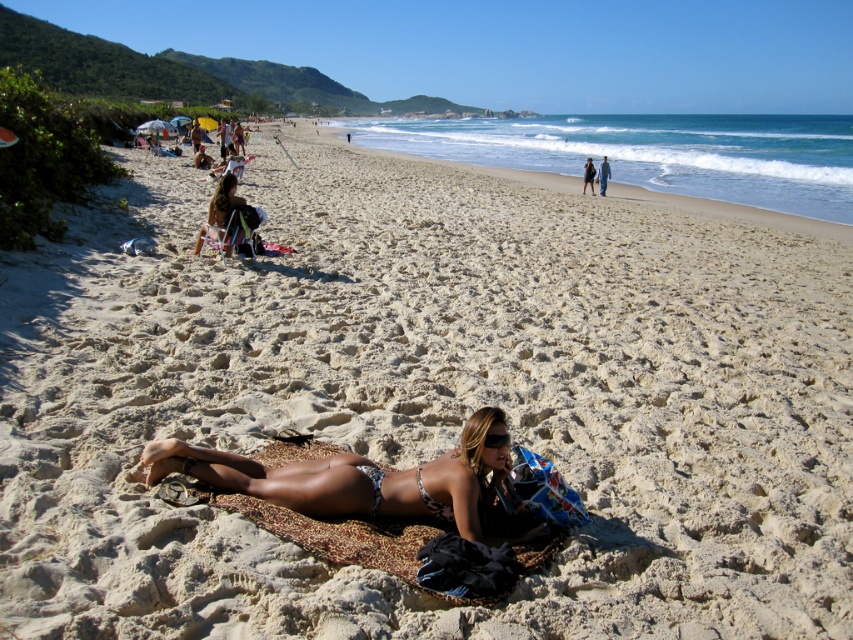
Does leopard print fabric at center have a lesser height compared to dark blue fabric bag at center?

Indeed, leopard print fabric at center has a lesser height compared to dark blue fabric bag at center.

Does point (541, 556) come in front of point (589, 170)?

Yes, point (541, 556) is in front of point (589, 170).

The image size is (853, 640). What are the coordinates of `leopard print fabric at center` in the screenshot? It's located at (340, 534).

Which of these two, dark blue fabric bag at center or blue denim jeans at center, stands taller?

blue denim jeans at center

Can you confirm if dark blue fabric bag at center is wider than blue denim jeans at center?

No.

Measure the distance between point (x=585, y=176) and camera.

The distance of point (x=585, y=176) from camera is 22.05 meters.

Image resolution: width=853 pixels, height=640 pixels. I want to click on dark blue fabric bag at center, so (x=589, y=176).

Does point (405, 474) come closer to viewer compared to point (337, 525)?

That is False.

Does printed bikini at center have a lesser height compared to leopard print fabric at center?

In fact, printed bikini at center may be taller than leopard print fabric at center.

Does point (440, 518) come behind point (368, 525)?

That is True.

In order to click on printed bikini at center in this screenshot , I will do `click(363, 480)`.